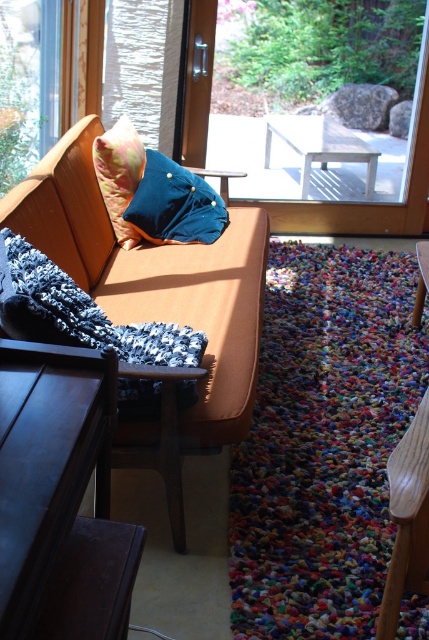
You are standing at the sofa and want to walk to the door. You see two points marked on the floor, point 1 at point (69, 468) and point 2 at point (404, 225). Which point is closer to your current position?

Point 1 at point (69, 468) is closer to your current position because it is in front of point 2 at point (404, 225).

You are an interior designer assessing the space. You need to determine if a large potted plant that is 1.2 meters wide can fit through the transparent glass door at upper center without removing the matte blue cushion at center. Can it fit?

The transparent glass door at upper center has a larger size compared to the matte blue cushion at center. Since the door is larger, the 1.2 meters wide potted plant can likely fit through the transparent glass door at upper center without needing to remove the matte blue cushion at center.

You are a delivery person trying to bring a large package through the transparent glass door at upper center. The package is as thick as the dark wood table at lower left. Will the package fit through the door?

The dark wood table at lower left is thinner than the transparent glass door at upper center. Since the package is as thick as the dark wood table at lower left, it will fit through the door because the door is thicker than the package.